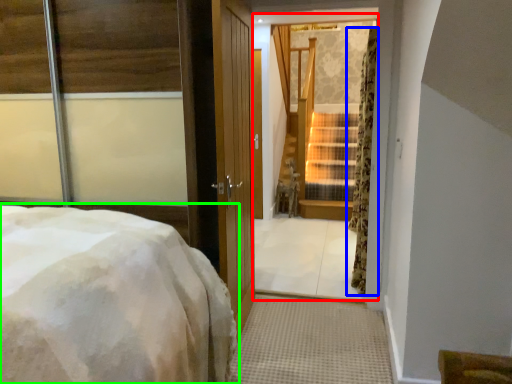
Question: Which object is positioned farthest from window (highlighted by a red box)? Select from curtain (highlighted by a blue box) and bed (highlighted by a green box).

Choices:
 (A) curtain
 (B) bed

Answer: (B)